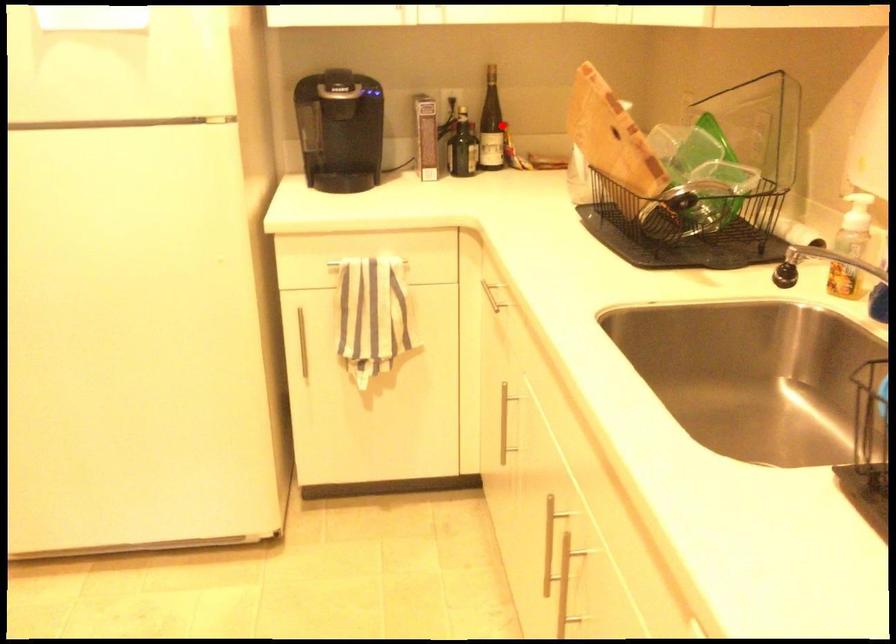
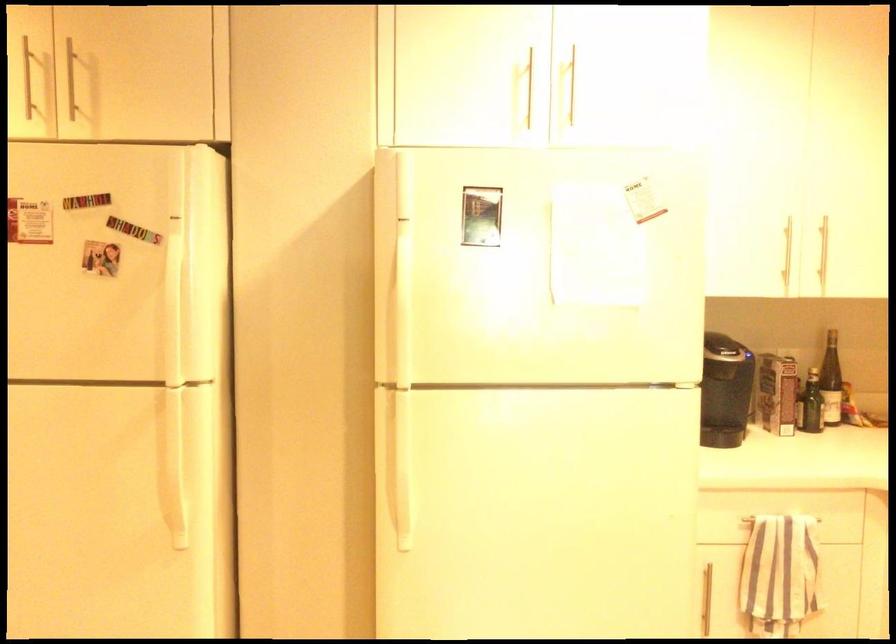
The point at the highlighted location is marked in the first image. Where is the corresponding point in the second image?

(831, 381)